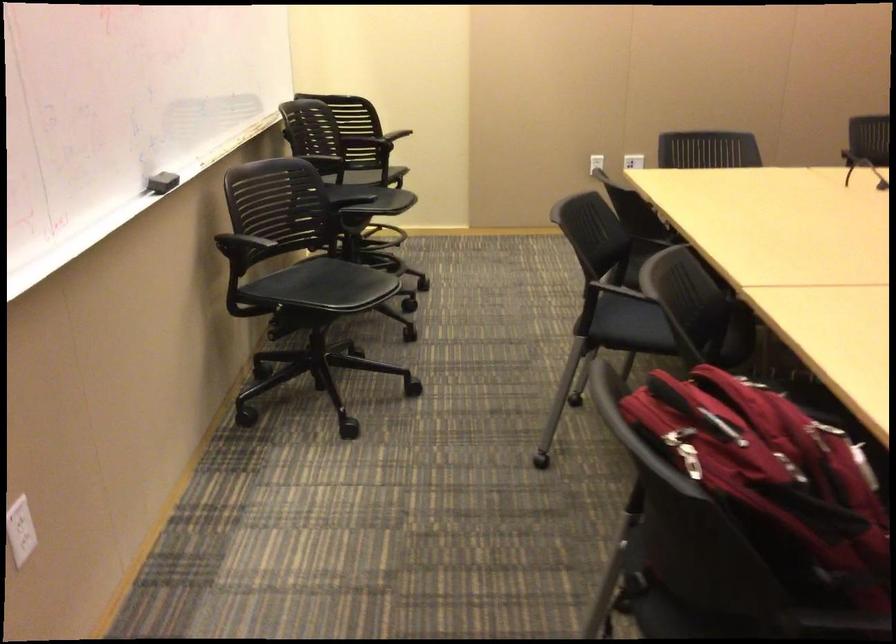
Find where to pull the backpack zipper pull. Please return your answer as a coordinate pair (x, y).

(690, 460)